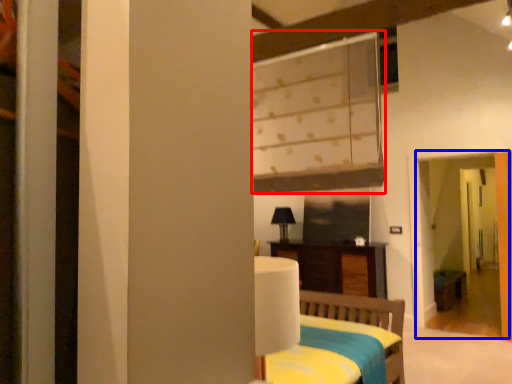
Question: Which object is closer to the camera taking this photo, window (highlighted by a red box) or screen door (highlighted by a blue box)?

Choices:
 (A) window
 (B) screen door

Answer: (A)